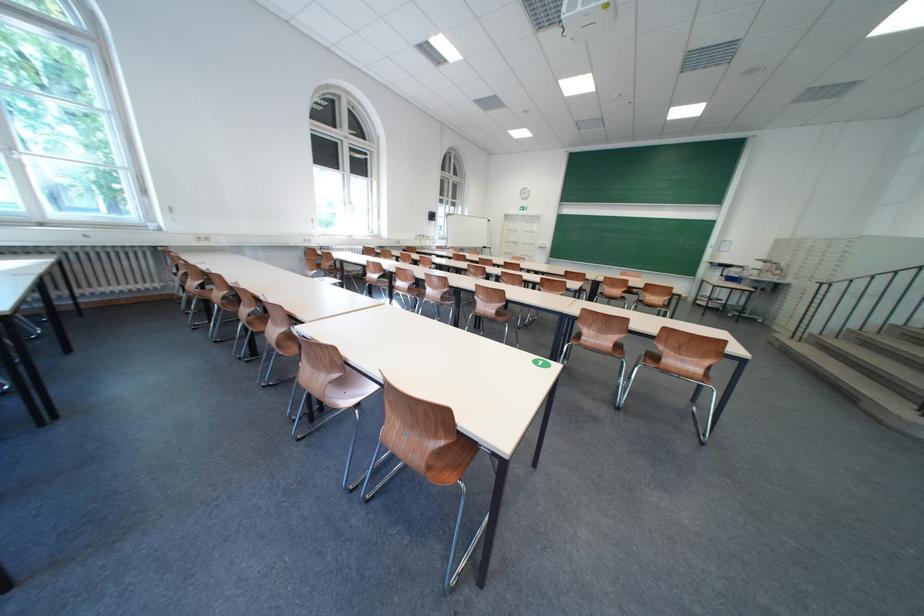
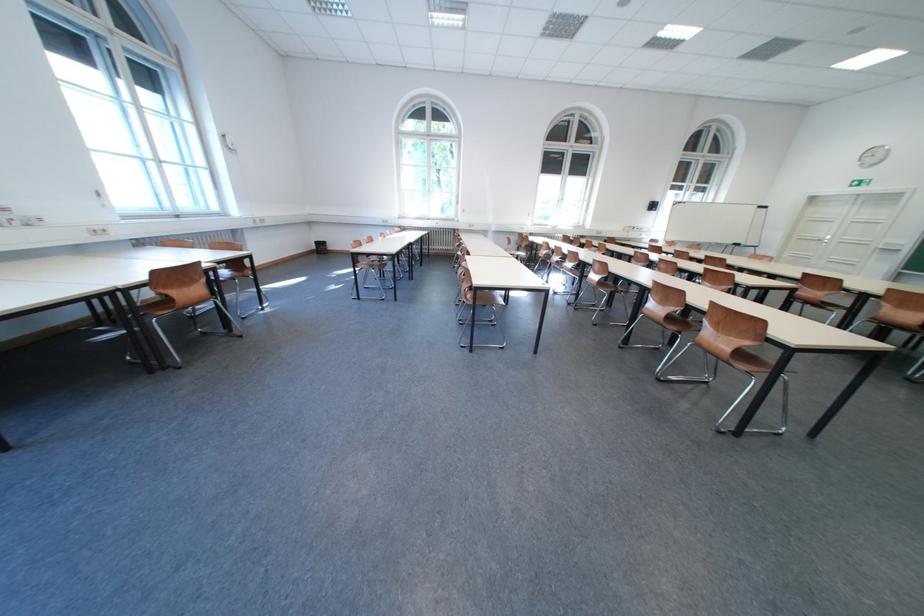
Where in the second image is the point corresponding to (578,275) from the first image?

(813, 278)